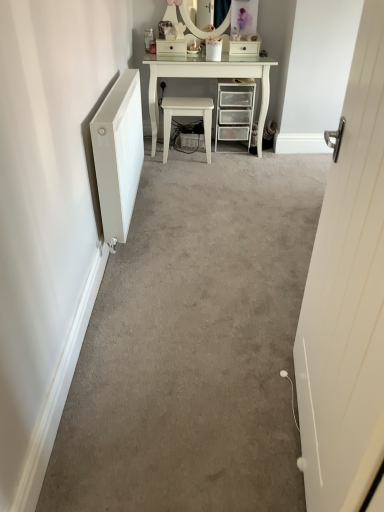
Locate an element on the screen. free point to the right of white glossy stool at center is located at coordinates (226, 161).